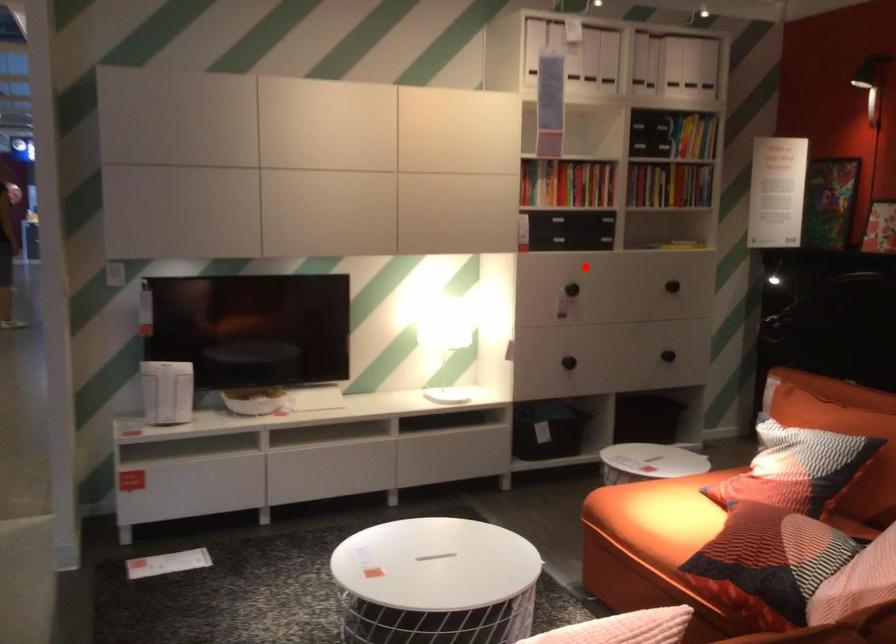
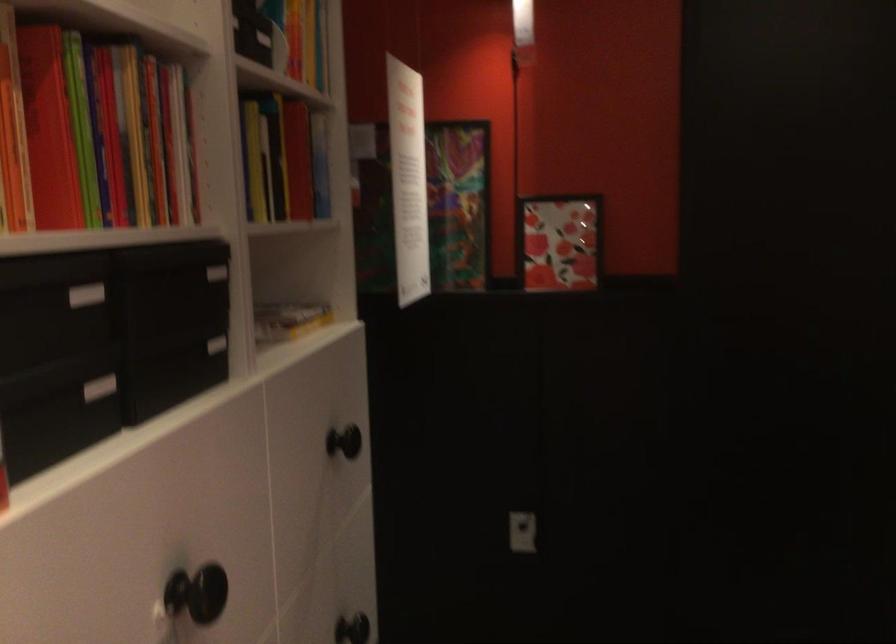
Find the pixel in the second image that matches the highlighted location in the first image.

(196, 592)